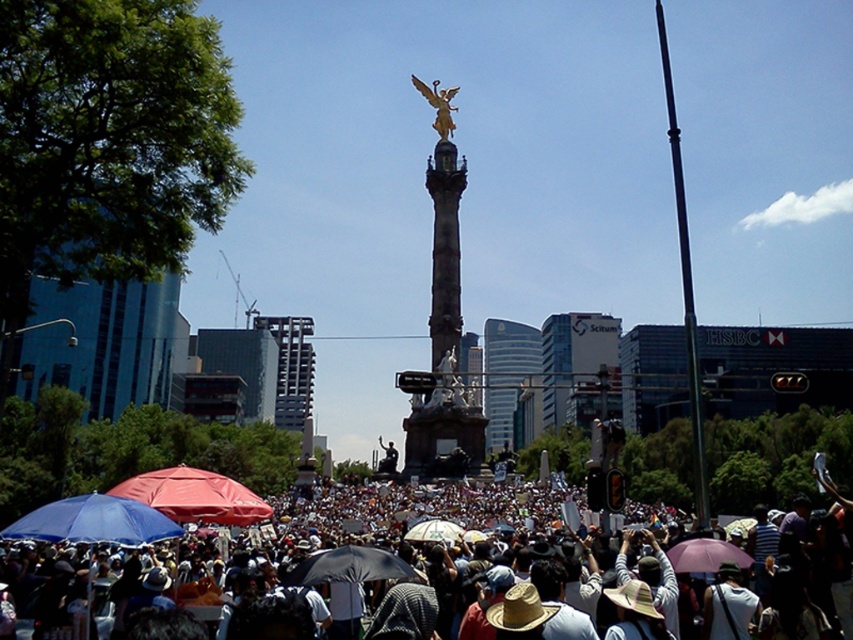
Based on the photo, who is positioned more to the right, white cotton crowd at center or purple matte umbrella at center?

purple matte umbrella at center

Between white cotton crowd at center and purple matte umbrella at center, which one appears on the left side from the viewer's perspective?

white cotton crowd at center

Identify the location of white cotton crowd at center. (351, 506).

Which is above, gold polished statue at center or white fabric umbrella at center?

gold polished statue at center is above.

Between point (444, 387) and point (421, 536), which one is positioned behind?

The point (444, 387) is behind.

Who is more forward, (454, 218) or (444, 532)?

Point (444, 532)

Where is `gold polished statue at center`? The image size is (853, 640). gold polished statue at center is located at coordinates (442, 326).

Who is taller, glassy blue skyscraper at center or black matte umbrella at center?

Standing taller between the two is glassy blue skyscraper at center.

Is point (502, 320) in front of point (318, 573)?

No, it is not.

Who is more forward, (497, 321) or (335, 554)?

Point (335, 554) is more forward.

Find the location of a particular element. The width and height of the screenshot is (853, 640). glassy blue skyscraper at center is located at coordinates (506, 374).